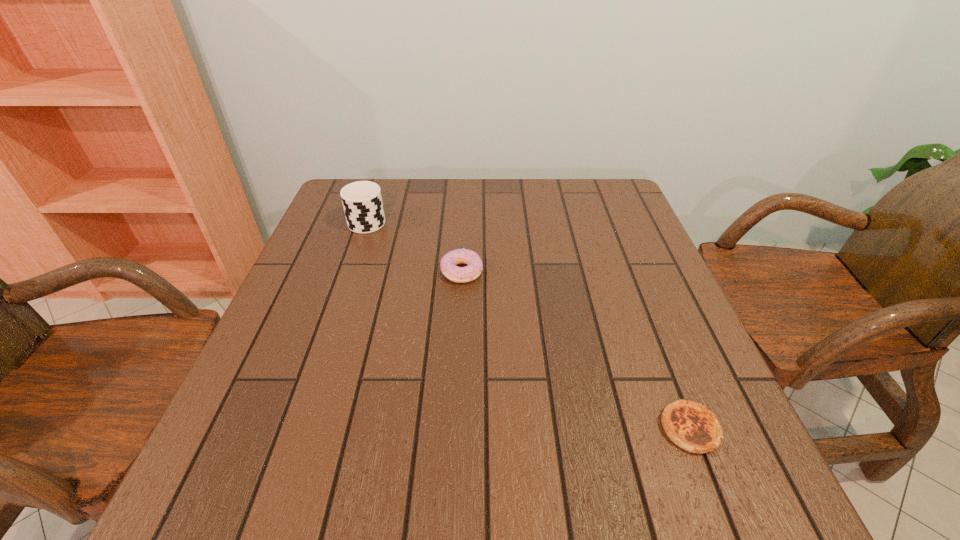
Select which object appears as the second closest to the quiche. Please provide its 2D coordinates. Your answer should be formatted as a tuple, i.e. [(x, y)], where the tuple contains the x and y coordinates of a point satisfying the conditions above.

[(362, 201)]

The height and width of the screenshot is (540, 960). What are the coordinates of `object that ranks as the second closest to the shortest object` in the screenshot? It's located at (362, 201).